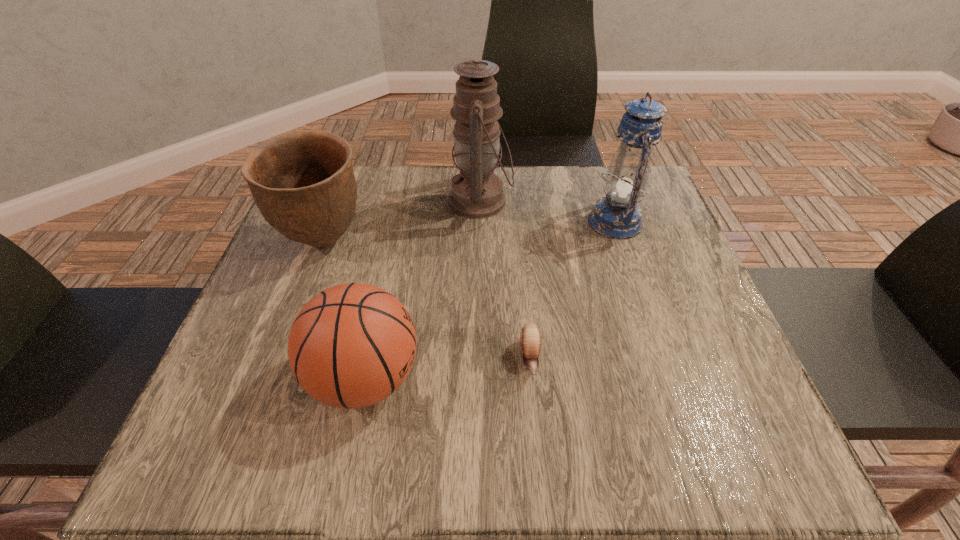
This screenshot has height=540, width=960. Identify the location of free space that satisfies the following two spatial constraints: 1. on the front-facing side of the escargot; 2. on the surface of the basketball near the brand logo. (532, 377).